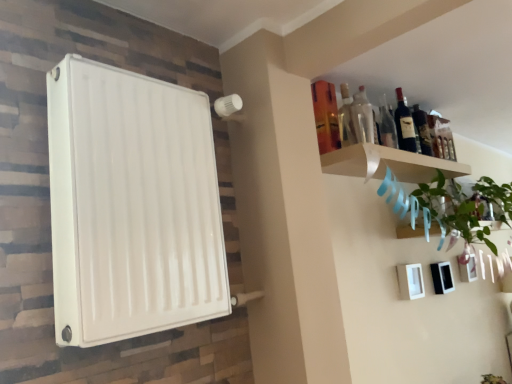
Question: Is dark glass bottle at upper right, which is the first bottle in back-to-front order, shorter than white matte picture frame at lower right?

Choices:
 (A) no
 (B) yes

Answer: (A)

Question: Is the surface of dark glass bottle at upper right, which is the fourth bottle in front-to-back order, in direct contact with white matte picture frame at lower right?

Choices:
 (A) no
 (B) yes

Answer: (A)

Question: Can you confirm if dark glass bottle at upper right, which is counted as the 4th bottle, starting from the left, is smaller than white matte picture frame at lower right?

Choices:
 (A) no
 (B) yes

Answer: (B)

Question: Is dark glass bottle at upper right, which is the first bottle in back-to-front order, at the right side of white matte picture frame at lower right?

Choices:
 (A) yes
 (B) no

Answer: (A)

Question: From a real-world perspective, is dark glass bottle at upper right, which is the fourth bottle in front-to-back order, physically above white matte picture frame at lower right?

Choices:
 (A) no
 (B) yes

Answer: (B)

Question: Considering the positions of point (356, 117) and point (408, 168), is point (356, 117) closer or farther from the camera than point (408, 168)?

Choices:
 (A) closer
 (B) farther

Answer: (A)

Question: From the image's perspective, relative to white wood shelf at upper right, is transparent glass bottle at upper right, marked as the 1th bottle in a front-to-back arrangement, above or below?

Choices:
 (A) below
 (B) above

Answer: (B)

Question: Is transparent glass bottle at upper right, marked as the first bottle in a left-to-right arrangement, wider or thinner than white wood shelf at upper right?

Choices:
 (A) wide
 (B) thin

Answer: (B)

Question: Relative to white wood shelf at upper right, is transparent glass bottle at upper right, marked as the first bottle in a left-to-right arrangement, in front or behind?

Choices:
 (A) front
 (B) behind

Answer: (B)

Question: From a real-world perspective, is green leafy plant at upper right physically located above or below white wood shelf at upper right?

Choices:
 (A) above
 (B) below

Answer: (B)

Question: Is green leafy plant at upper right wider or thinner than white wood shelf at upper right?

Choices:
 (A) wide
 (B) thin

Answer: (A)

Question: Considering the positions of green leafy plant at upper right and white wood shelf at upper right in the image, is green leafy plant at upper right bigger or smaller than white wood shelf at upper right?

Choices:
 (A) small
 (B) big

Answer: (B)

Question: From the image's perspective, is green leafy plant at upper right above or below white wood shelf at upper right?

Choices:
 (A) below
 (B) above

Answer: (A)

Question: Visually, is dark glass bottle at upper right, which is the first bottle in back-to-front order, positioned to the left or to the right of dark glass bottle at upper right, which appears as the 3th bottle when viewed from the back?

Choices:
 (A) right
 (B) left

Answer: (A)

Question: From a real-world perspective, is dark glass bottle at upper right, which is counted as the 4th bottle, starting from the left, physically located above or below dark glass bottle at upper right, which is counted as the third bottle, starting from the left?

Choices:
 (A) above
 (B) below

Answer: (B)